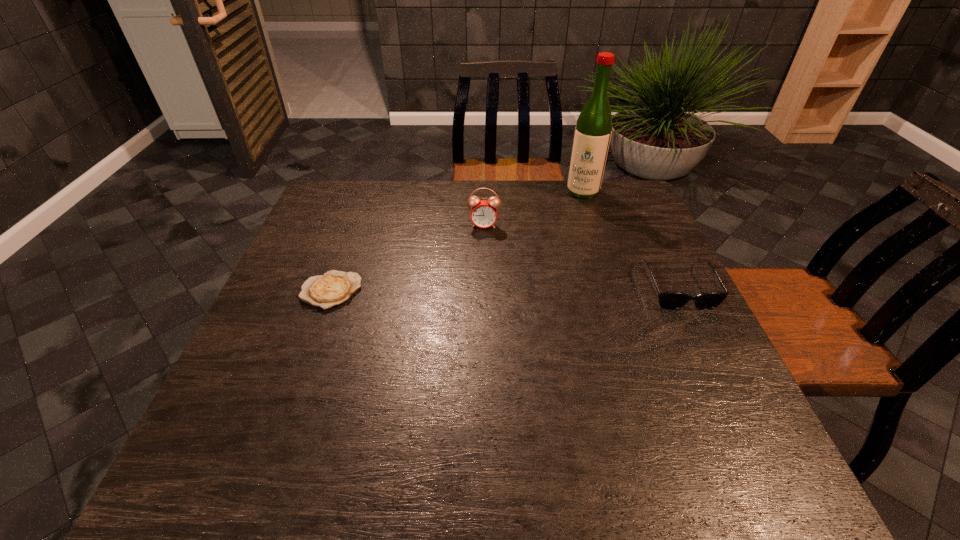
Locate an element on the screen. liquor that is at the right edge is located at coordinates (593, 129).

Image resolution: width=960 pixels, height=540 pixels. Identify the location of object at the far right corner. (593, 129).

Where is `vacant space at the far edge of the desktop`? The image size is (960, 540). vacant space at the far edge of the desktop is located at coordinates (401, 180).

You are a GUI agent. You are given a task and a screenshot of the screen. Output one action in this format:
    pyautogui.click(x=<x>, y=<y>)
    Task: Click on the vacant area at the near edge of the desktop
    
    Given the screenshot: What is the action you would take?
    pyautogui.click(x=612, y=429)

Locate an element on the screen. vacant region at the left edge of the desktop is located at coordinates (327, 227).

You are a GUI agent. You are given a task and a screenshot of the screen. Output one action in this format:
    pyautogui.click(x=<x>, y=<y>)
    Task: Click on the vacant space at the right edge
    The height and width of the screenshot is (540, 960).
    Given the screenshot: What is the action you would take?
    pyautogui.click(x=676, y=268)

I want to click on vacant space at the far left corner of the desktop, so click(345, 181).

In the image, there is a desktop. At what (x,y) coordinates should I click in order to perform the action: click on vacant space at the near left corner. Please return your answer as a coordinate pair (x, y). This screenshot has height=540, width=960. Looking at the image, I should click on (219, 403).

Locate an element on the screen. Image resolution: width=960 pixels, height=540 pixels. vacant position at the far right corner of the desktop is located at coordinates (635, 199).

Image resolution: width=960 pixels, height=540 pixels. I want to click on free spot between the leftmost object and the rightmost object, so click(504, 288).